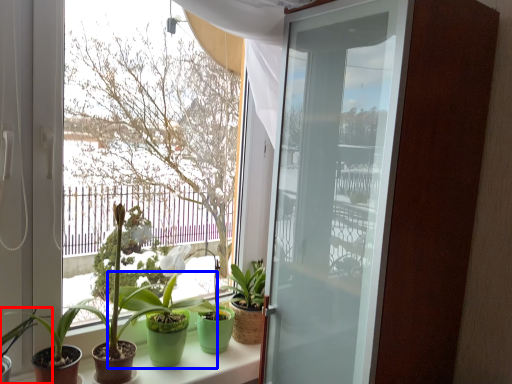
Question: Which object appears farthest to the camera in this image, houseplant (highlighted by a red box) or houseplant (highlighted by a blue box)?

Choices:
 (A) houseplant
 (B) houseplant

Answer: (B)